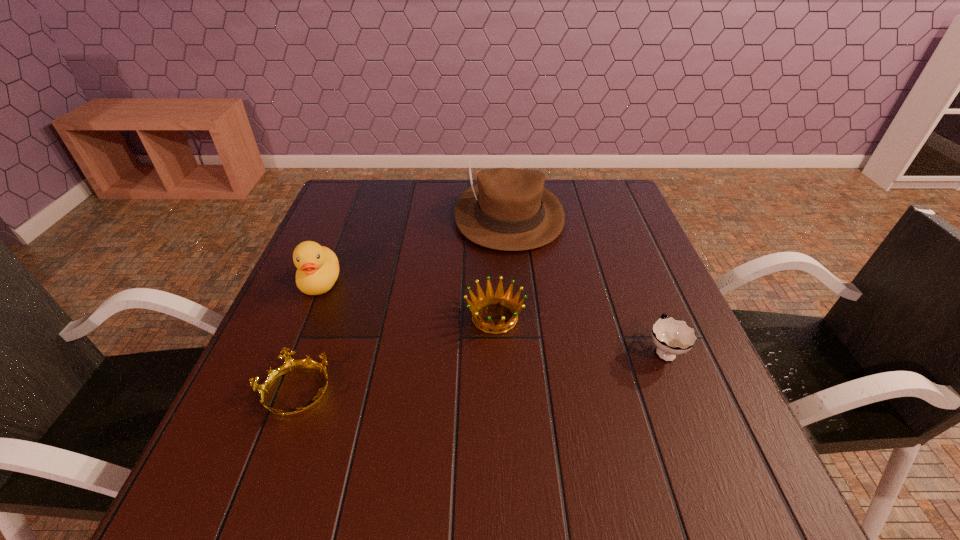
Find the location of a particular element. This screenshot has width=960, height=540. free area in between the tallest object and the cup is located at coordinates (587, 282).

Identify the location of free space that is in between the rightmost object and the farthest object. (587, 282).

Locate an element on the screen. This screenshot has height=540, width=960. free spot between the tallest object and the cup is located at coordinates (587, 282).

Find the location of a particular element. Image resolution: width=960 pixels, height=540 pixels. empty space that is in between the farther crown and the fedora is located at coordinates (502, 266).

At what (x,y) coordinates should I click in order to perform the action: click on free space that is in between the cup and the taller crown. Please return your answer as a coordinate pair (x, y). Image resolution: width=960 pixels, height=540 pixels. Looking at the image, I should click on (579, 334).

Locate an element on the screen. free space between the cup and the shortest object is located at coordinates (480, 372).

The image size is (960, 540). Find the location of `object that can be found as the closest to the fedora`. object that can be found as the closest to the fedora is located at coordinates coord(489,297).

Select which object appears as the second closest to the cup. Please provide its 2D coordinates. Your answer should be formatted as a tuple, i.e. [(x, y)], where the tuple contains the x and y coordinates of a point satisfying the conditions above.

[(509, 209)]

Locate an element on the screen. free space that satisfies the following two spatial constraints: 1. at the beak of the fourth shortest object; 2. on the left side of the left crown is located at coordinates (276, 393).

Image resolution: width=960 pixels, height=540 pixels. Identify the location of vacant area that satisfies the following two spatial constraints: 1. at the beak of the nearer crown; 2. on the left side of the duck. (276, 393).